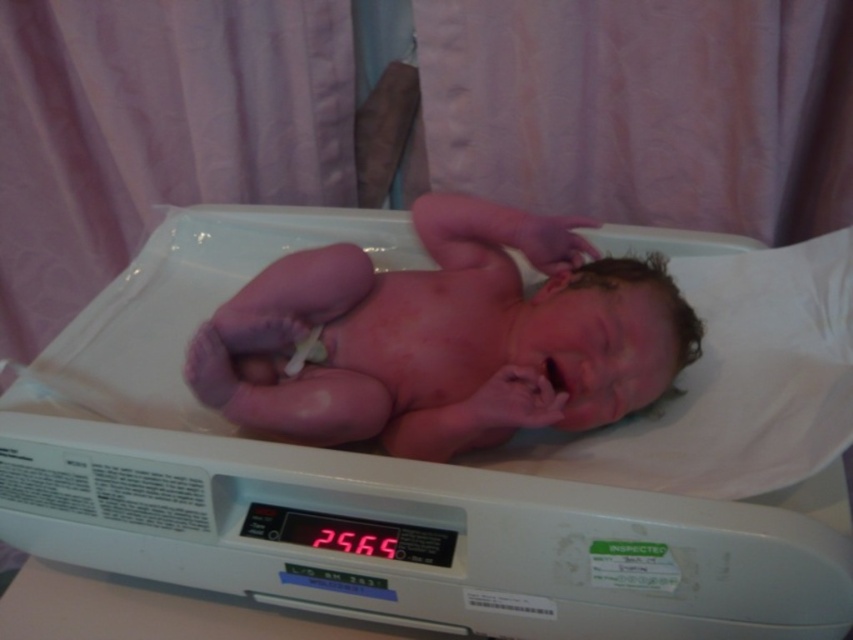
Between point (224, 438) and point (608, 289), which one is positioned behind?

Positioned behind is point (608, 289).

Is the position of white plastic scale at center less distant than that of pink smooth skin at center?

That is True.

At what (x,y) coordinates should I click in order to perform the action: click on white plastic scale at center. Please return your answer as a coordinate pair (x, y). Looking at the image, I should click on (416, 476).